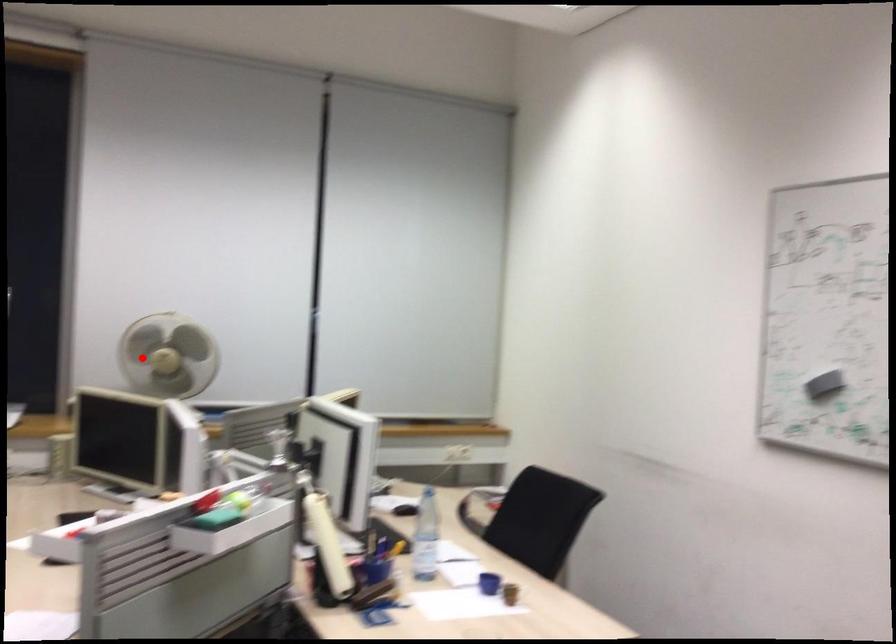
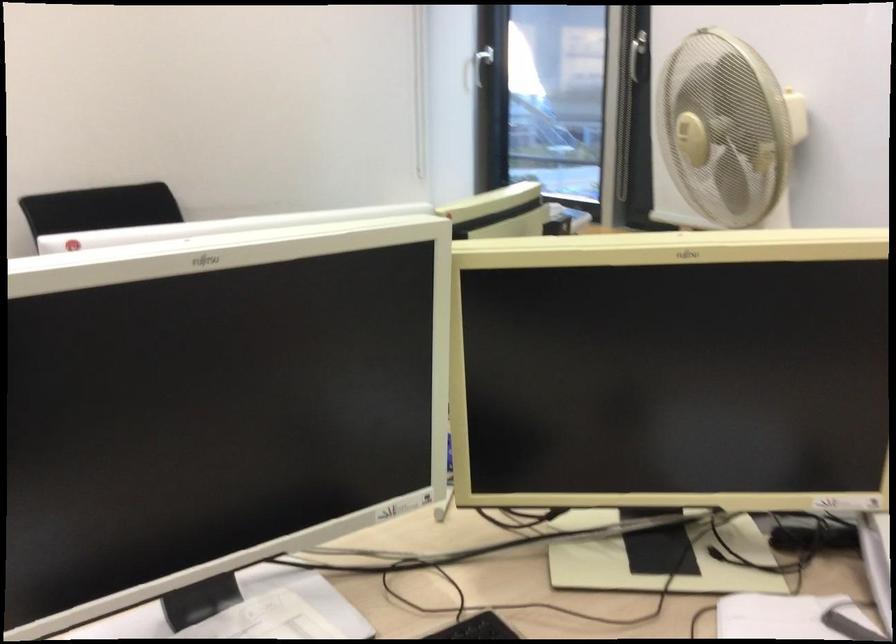
Question: I am providing you with two images of the same scene from different viewpoints. A red point is shown in image1. For the corresponding object point in image2, is it positioned nearer or farther from the camera?

Choices:
 (A) Nearer
 (B) Farther

Answer: (A)